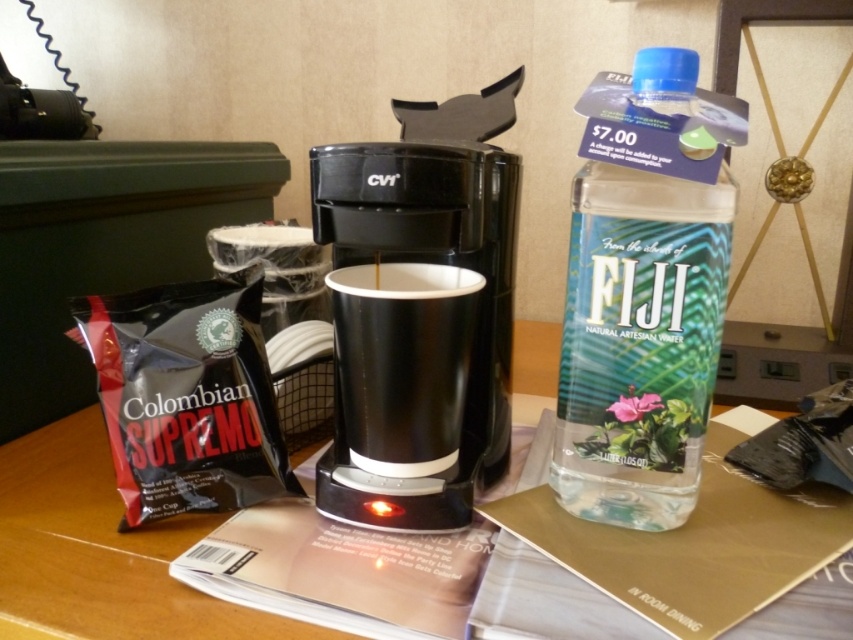
Question: In this image, where is clear plastic bottle at upper right located relative to black matte cup at center?

Choices:
 (A) right
 (B) left

Answer: (A)

Question: Which point is farther from the camera taking this photo?

Choices:
 (A) (428, 440)
 (B) (616, 477)
 (C) (503, 122)

Answer: (C)

Question: Is black plastic coffee maker at center wider than clear plastic bottle at upper right?

Choices:
 (A) no
 (B) yes

Answer: (B)

Question: Which point is closer to the camera?

Choices:
 (A) (665, 141)
 (B) (372, 266)
 (C) (218, 323)

Answer: (A)

Question: Is clear plastic bottle at upper right in front of black matte bag of colombian supremo coffee at lower left?

Choices:
 (A) yes
 (B) no

Answer: (A)

Question: Estimate the real-world distances between objects in this image. Which object is farther from the black plastic coffee maker at center?

Choices:
 (A) black matte bag of colombian supremo coffee at lower left
 (B) black matte cup at center

Answer: (A)